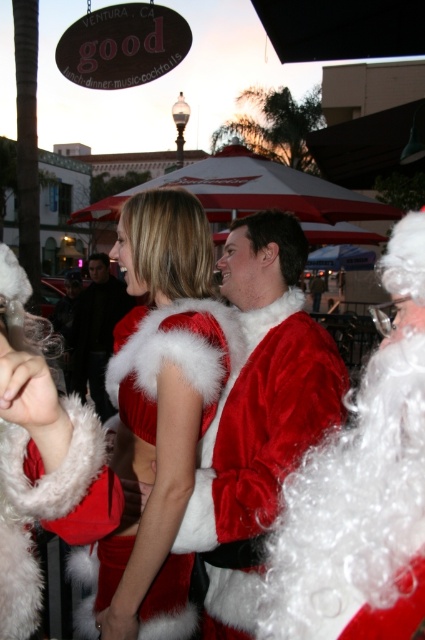
Question: In this image, where is velvet red dress at center located relative to dark gray fabric jacket at center?

Choices:
 (A) below
 (B) above

Answer: (A)

Question: Which object is positioned closest to the velvet santa at right?

Choices:
 (A) dark gray fabric jacket at center
 (B) velvet santa suit at center

Answer: (B)

Question: Which of these objects is positioned farthest from the dark gray fabric jacket at center?

Choices:
 (A) velvet red dress at center
 (B) velvet santa at right

Answer: (B)

Question: Can you confirm if velvet santa at right is positioned to the left of velvet red dress at center?

Choices:
 (A) no
 (B) yes

Answer: (A)

Question: Which point is farther to the camera?

Choices:
 (A) dark gray fabric jacket at center
 (B) velvet santa suit at center
 (C) velvet red dress at center
 (D) velvet santa at right

Answer: (A)

Question: Is velvet santa suit at center to the left of dark gray fabric jacket at center from the viewer's perspective?

Choices:
 (A) yes
 (B) no

Answer: (B)